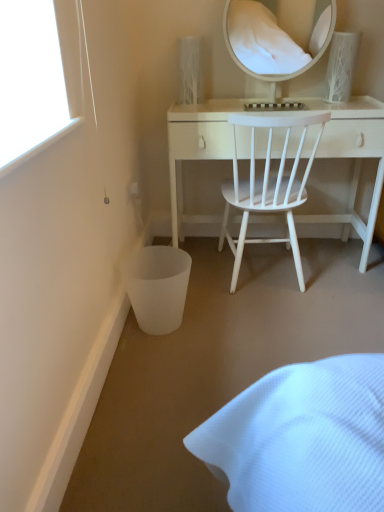
The width and height of the screenshot is (384, 512). In order to click on vacant space to the left of white textured vase at upper right in this screenshot , I will do `click(315, 101)`.